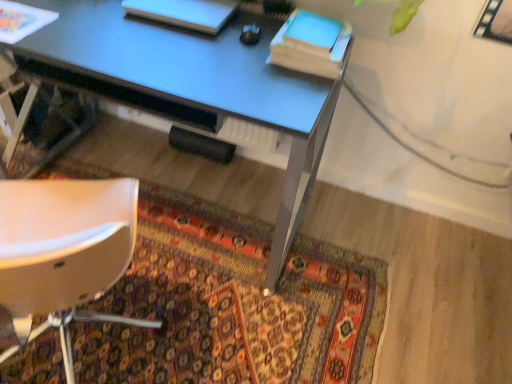
In order to click on spots to the right of white plastic chair at lower left in this screenshot , I will do `click(238, 328)`.